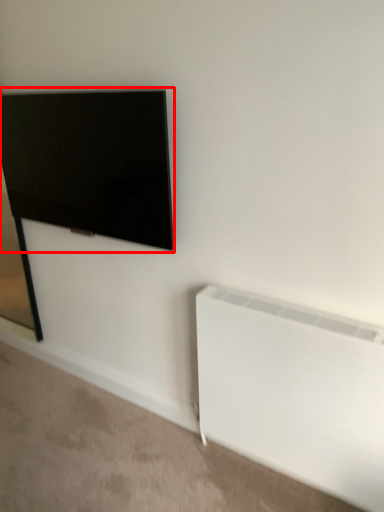
Question: Where is television (annotated by the red box) located in relation to radiator in the image?

Choices:
 (A) left
 (B) right

Answer: (A)